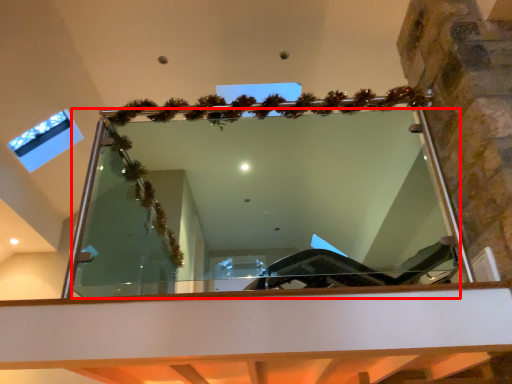
Question: From the image's perspective, what is the correct spatial relationship of mirror (annotated by the red box) in relation to window?

Choices:
 (A) below
 (B) above

Answer: (A)